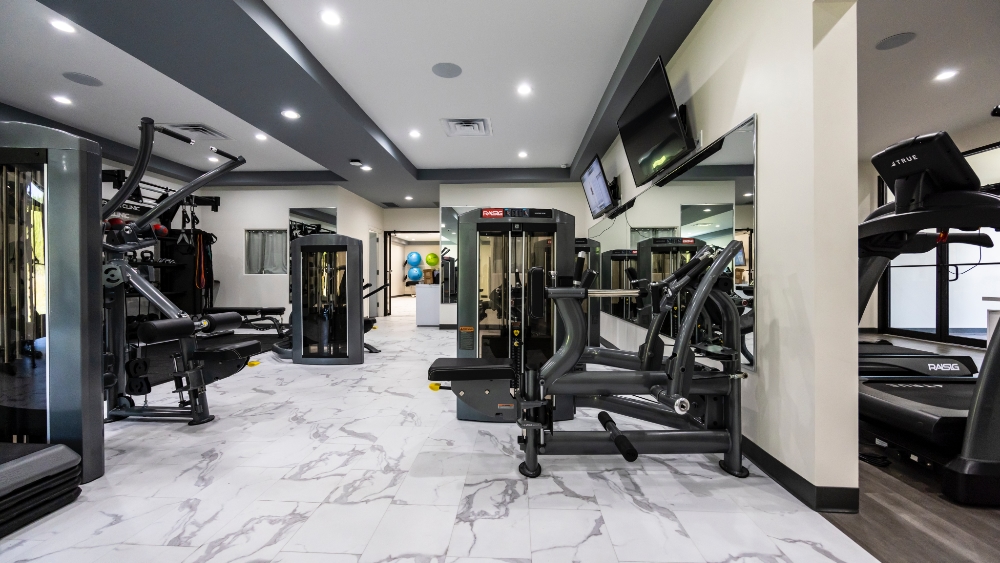
I want to click on ceiling, so click(519, 34), click(955, 43).